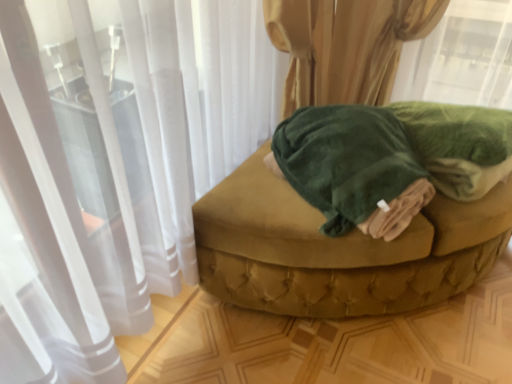
Question: From a real-world perspective, is velvet green ottoman at center positioned above or below green plush bath towel at center?

Choices:
 (A) above
 (B) below

Answer: (B)

Question: From the image's perspective, is velvet green ottoman at center above or below green plush bath towel at center?

Choices:
 (A) below
 (B) above

Answer: (A)

Question: Considering the positions of velvet green ottoman at center and green plush bath towel at center in the image, is velvet green ottoman at center bigger or smaller than green plush bath towel at center?

Choices:
 (A) big
 (B) small

Answer: (A)

Question: In terms of size, does green plush bath towel at center appear bigger or smaller than velvet green ottoman at center?

Choices:
 (A) big
 (B) small

Answer: (B)

Question: Choose the correct answer: Is green plush bath towel at center inside velvet green ottoman at center or outside it?

Choices:
 (A) outside
 (B) inside

Answer: (A)

Question: Considering their positions, is green plush bath towel at center located in front of or behind velvet green ottoman at center?

Choices:
 (A) behind
 (B) front

Answer: (B)

Question: From the image's perspective, is green plush bath towel at center positioned above or below velvet green ottoman at center?

Choices:
 (A) below
 (B) above

Answer: (B)